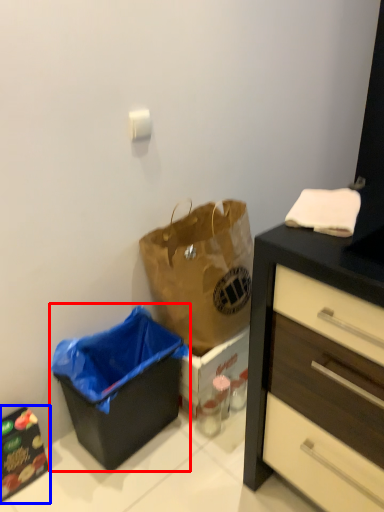
Question: Which of the following is the closest to the observer, recycling bin (highlighted by a red box) or cabinetry (highlighted by a blue box)?

Choices:
 (A) recycling bin
 (B) cabinetry

Answer: (A)